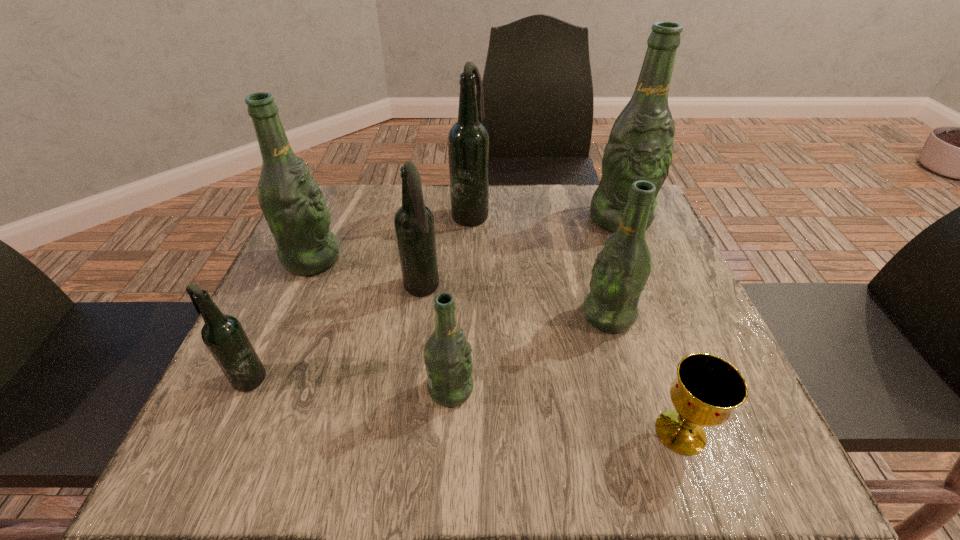
Where is `the farthest green beer bottle`? The image size is (960, 540). the farthest green beer bottle is located at coordinates (640, 147).

Where is `the biggest green beer bottle`? The width and height of the screenshot is (960, 540). the biggest green beer bottle is located at coordinates (640, 147).

This screenshot has width=960, height=540. I want to click on the biggest dark beer bottle, so click(468, 140).

Locate an element on the screen. Image resolution: width=960 pixels, height=540 pixels. the farthest dark beer bottle is located at coordinates (468, 140).

Where is `the third smallest green beer bottle`? the third smallest green beer bottle is located at coordinates (292, 203).

Find the location of `the second farthest green beer bottle`. the second farthest green beer bottle is located at coordinates (292, 203).

Locate an element on the screen. the second nearest green beer bottle is located at coordinates (620, 272).

Find the location of `the second nearest dark beer bottle`. the second nearest dark beer bottle is located at coordinates (414, 224).

Identify the location of the second dark beer bottle from left to right. This screenshot has width=960, height=540. (414, 224).

At what (x,y) coordinates should I click in order to perform the action: click on the smallest dark beer bottle. Please return your answer as a coordinate pair (x, y). Looking at the image, I should click on (224, 336).